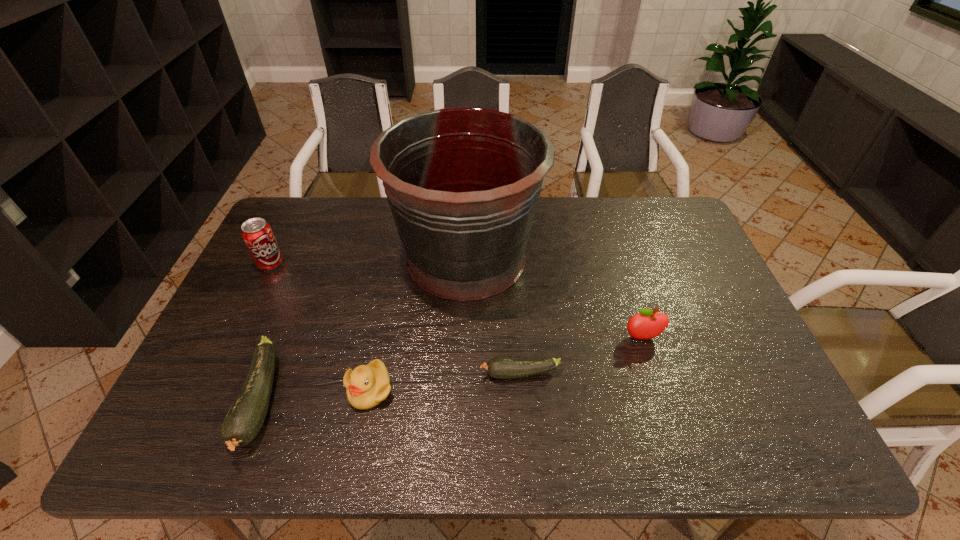
At what (x,y) coordinates should I click in order to perform the action: click on vacant area that lies between the shorter zucchini and the duckling. Please return your answer as a coordinate pair (x, y). The height and width of the screenshot is (540, 960). Looking at the image, I should click on (444, 381).

This screenshot has width=960, height=540. Identify the location of vacant space in between the soda and the bucket. (369, 261).

Find the location of a particular element. unoccupied position between the fourth nearest object and the bucket is located at coordinates (554, 298).

You are a GUI agent. You are given a task and a screenshot of the screen. Output one action in this format:
    pyautogui.click(x=<x>, y=<y>)
    Task: Click on the free space between the right zucchini and the bucket
    This screenshot has width=960, height=540.
    Given the screenshot: What is the action you would take?
    pyautogui.click(x=493, y=315)

Find the location of a particular element. This screenshot has width=960, height=540. empty location between the leftmost object and the rightmost object is located at coordinates (457, 301).

Locate an element on the screen. The width and height of the screenshot is (960, 540). object that is the closest to the right zucchini is located at coordinates tap(463, 184).

Locate which object ranks third in proximity to the soda. Please provide its 2D coordinates. Your answer should be formatted as a tuple, i.e. [(x, y)], where the tuple contains the x and y coordinates of a point satisfying the conditions above.

[(368, 385)]

This screenshot has height=540, width=960. What are the coordinates of `vacant space that satisfies the following two spatial constraints: 1. on the front side of the leftmost object; 2. on the right side of the third tallest object` in the screenshot? It's located at (235, 338).